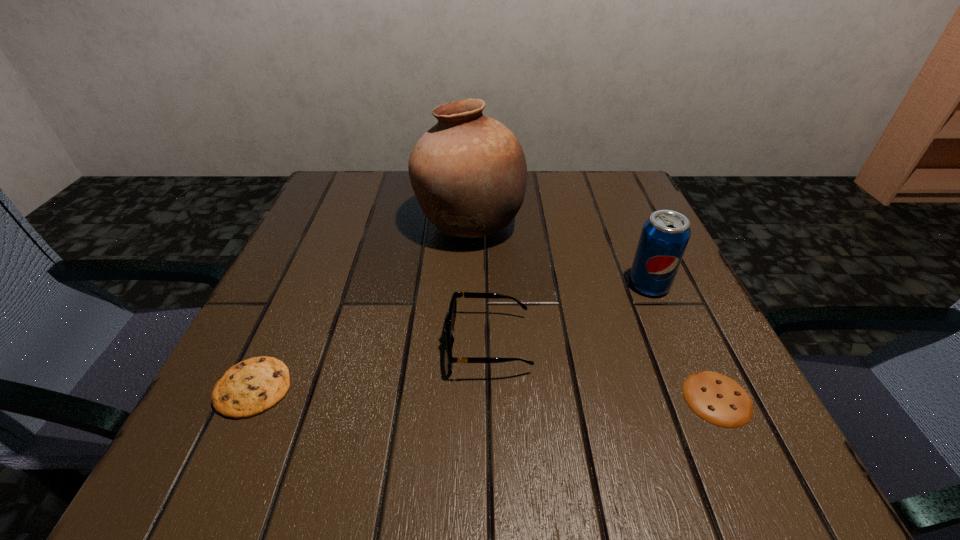
Locate an element on the screen. vacant region between the right cookie and the sunglasses is located at coordinates (603, 371).

In order to click on unoccupied position between the third tallest object and the second farthest object in this screenshot , I will do `click(568, 314)`.

Locate an element on the screen. vacant space in between the farthest object and the shorter cookie is located at coordinates (593, 310).

The width and height of the screenshot is (960, 540). Find the location of `free space between the pop soda and the right cookie`. free space between the pop soda and the right cookie is located at coordinates (684, 341).

Find the location of `free spot between the sunglasses and the shorter cookie`. free spot between the sunglasses and the shorter cookie is located at coordinates (603, 371).

This screenshot has width=960, height=540. I want to click on empty location between the pop soda and the farthest object, so click(560, 254).

This screenshot has width=960, height=540. Identify the location of blank region between the sunglasses and the shortest object. (603, 371).

Find the location of a particular element. The height and width of the screenshot is (540, 960). unoccupied area between the left cookie and the tallest object is located at coordinates (362, 306).

Where is `object that is the third closest one to the farthest object`? object that is the third closest one to the farthest object is located at coordinates (249, 388).

Point out which object is positioned as the third nearest to the sunglasses. Please provide its 2D coordinates. Your answer should be formatted as a tuple, i.e. [(x, y)], where the tuple contains the x and y coordinates of a point satisfying the conditions above.

[(718, 399)]